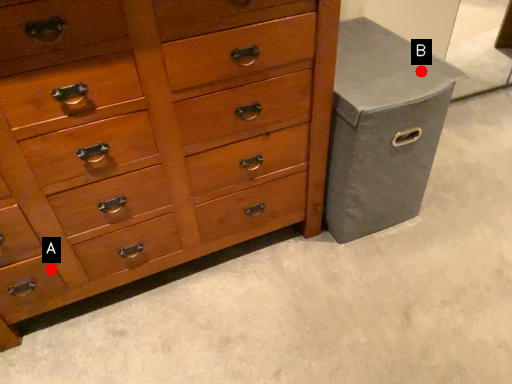
Question: Two points are circled on the image, labeled by A and B beside each circle. Among these points, which one is farthest from the camera?

Choices:
 (A) A is further
 (B) B is further

Answer: (B)